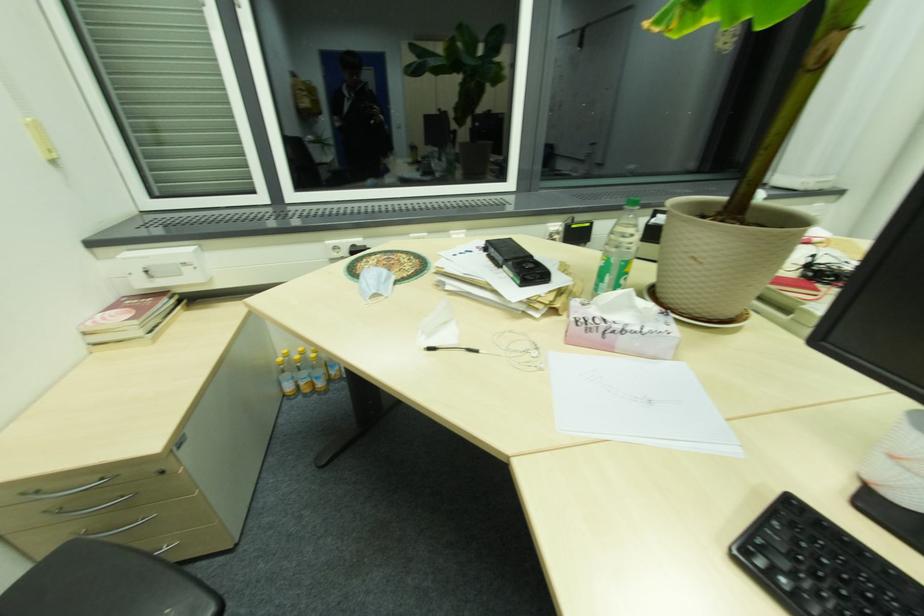
Find where to lift the plastic water bottle. Please return your answer as a coordinate pair (x, y).

(618, 249)